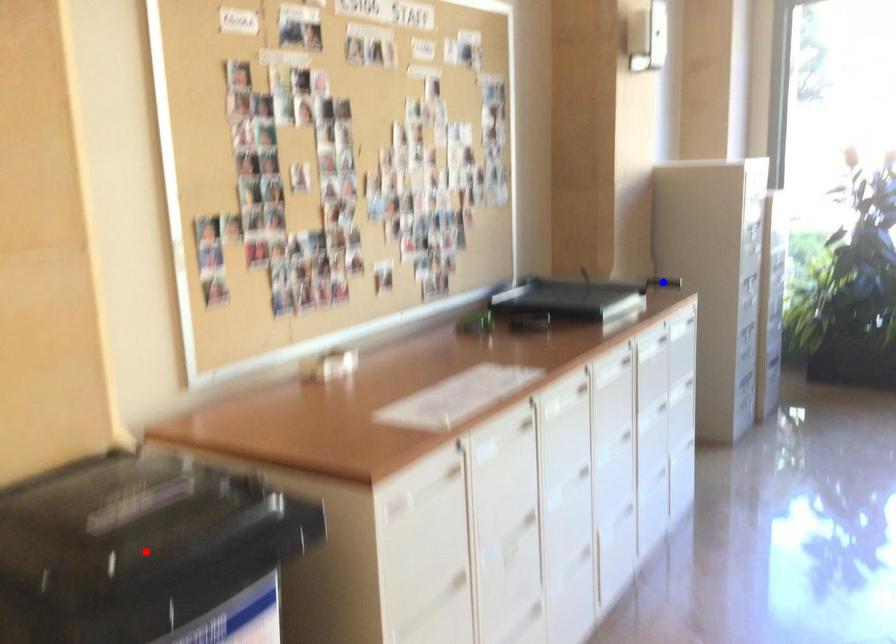
Question: Which of the two points in the image is closer to the camera?

Choices:
 (A) Blue point is closer.
 (B) Red point is closer.

Answer: (B)